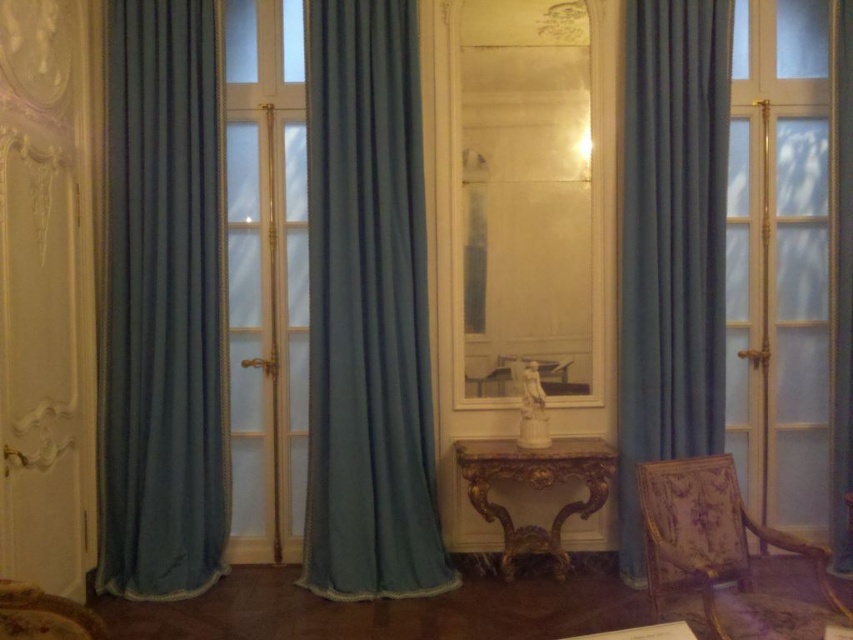
You are a guest in this room and want to sit down. You see the clear glass mirror at center and the patterned fabric armchair at lower right. Which object can you sit on?

The patterned fabric armchair at lower right is the object you can sit on, as the clear glass mirror at center is positioned above it and likely not designed for sitting.

You are a guest in this room and want to sit down on the patterned fabric armchair at lower right. To reach it, you must pass in front of the clear glass mirror at center. Is the path clear for you to walk directly to the armchair without needing to go around the mirror?

The patterned fabric armchair at lower right is behind the clear glass mirror at center, so the path to the armchair is blocked by the mirror. You will need to go around the mirror to reach the armchair.